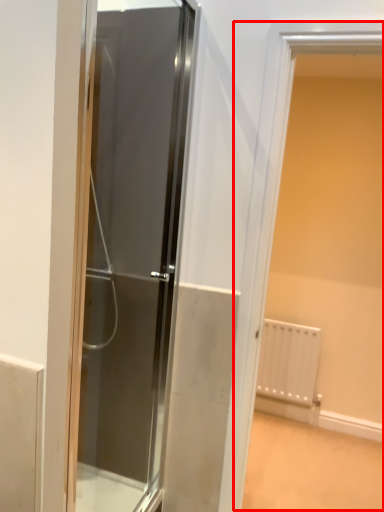
Question: From the image's perspective, what is the correct spatial positioning of window (annotated by the red box) in reference to door?

Choices:
 (A) below
 (B) above

Answer: (A)